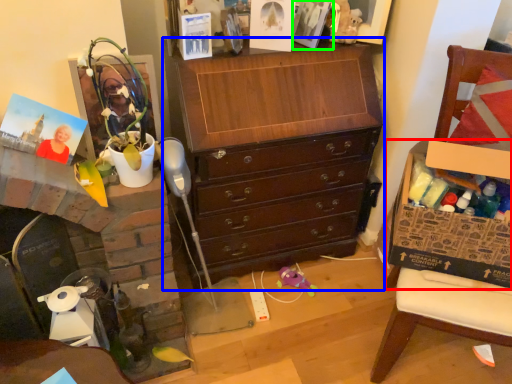
Question: Estimate the real-world distances between objects in this image. Which object is closer to cabinetry (highlighted by a red box), chest of drawers (highlighted by a blue box) or picture frame (highlighted by a green box)?

Choices:
 (A) chest of drawers
 (B) picture frame

Answer: (A)